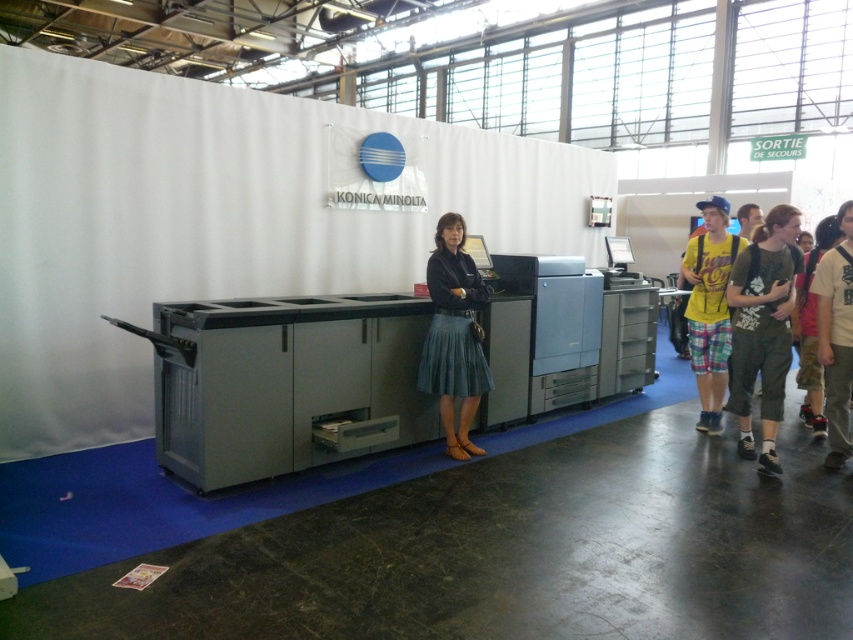
Question: Can you confirm if denim skirt at center is positioned above yellow cotton shirt at right?

Choices:
 (A) yes
 (B) no

Answer: (B)

Question: Is dark gray cotton pants at right positioned in front of white cotton t-shirt at right?

Choices:
 (A) yes
 (B) no

Answer: (A)

Question: Estimate the real-world distances between objects in this image. Which object is closer to the dark gray cotton pants at right?

Choices:
 (A) yellow cotton shirt at right
 (B) blue denim jeans at center

Answer: (A)

Question: Which point is closer to the camera taking this photo?

Choices:
 (A) (701, 384)
 (B) (746, 237)
 (C) (750, 285)
 (D) (480, 371)

Answer: (C)

Question: Which of these objects is positioned closest to the denim skirt at center?

Choices:
 (A) white cotton t-shirt at right
 (B) dark gray cotton pants at right
 (C) yellow cotton shirt at right

Answer: (B)

Question: Does denim skirt at center lie in front of blue denim jeans at center?

Choices:
 (A) no
 (B) yes

Answer: (B)